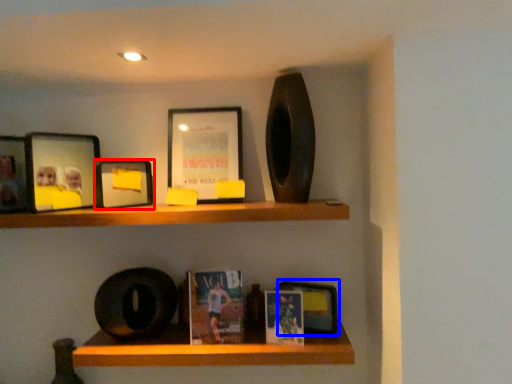
Question: Which object appears farthest to the camera in this image, picture frame (highlighted by a red box) or book cover (highlighted by a blue box)?

Choices:
 (A) picture frame
 (B) book cover

Answer: (B)